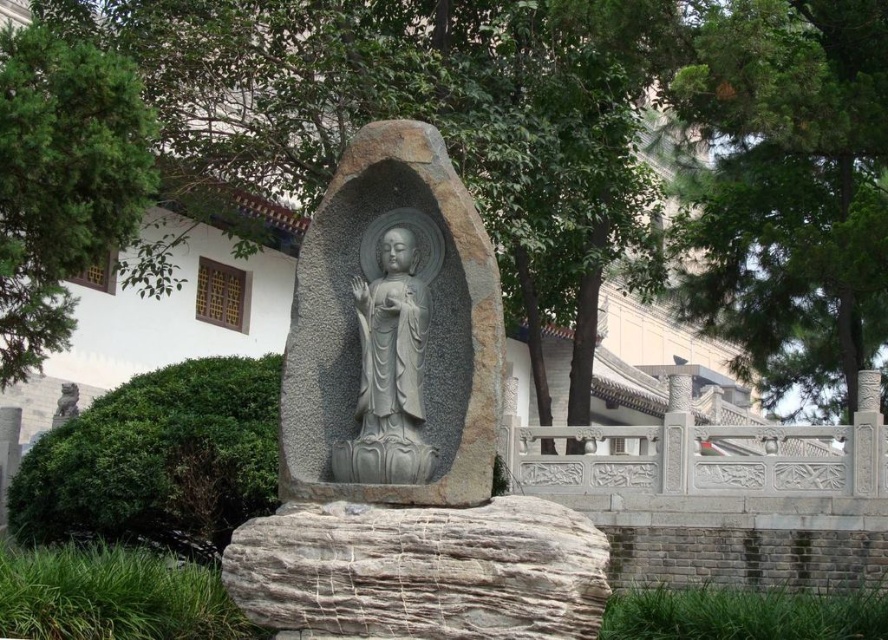
Can you confirm if green leafy tree at upper right is positioned to the left of green leafy tree at upper left?

In fact, green leafy tree at upper right is to the right of green leafy tree at upper left.

From the picture: Which of these two, green leafy tree at upper right or green leafy tree at upper left, stands taller?

Standing taller between the two is green leafy tree at upper right.

Is point (851, 72) positioned behind point (29, 205)?

Yes, point (851, 72) is farther from viewer.

Find the location of a particular element. The width and height of the screenshot is (888, 640). green leafy tree at upper right is located at coordinates (789, 193).

Who is higher up, green leafy tree at upper right or gray stone statue at center?

Positioned higher is green leafy tree at upper right.

The width and height of the screenshot is (888, 640). What do you see at coordinates (789, 193) in the screenshot?
I see `green leafy tree at upper right` at bounding box center [789, 193].

Where is `green leafy tree at upper right`? The width and height of the screenshot is (888, 640). green leafy tree at upper right is located at coordinates 789,193.

Measure the distance between green leafy tree at center and green leafy tree at upper right.

A distance of 7.74 meters exists between green leafy tree at center and green leafy tree at upper right.

Between green leafy tree at center and green leafy tree at upper right, which one is positioned lower?

Positioned lower is green leafy tree at upper right.

Describe the element at coordinates (565, 145) in the screenshot. I see `green leafy tree at center` at that location.

This screenshot has width=888, height=640. In order to click on green leafy tree at center in this screenshot , I will do `click(565, 145)`.